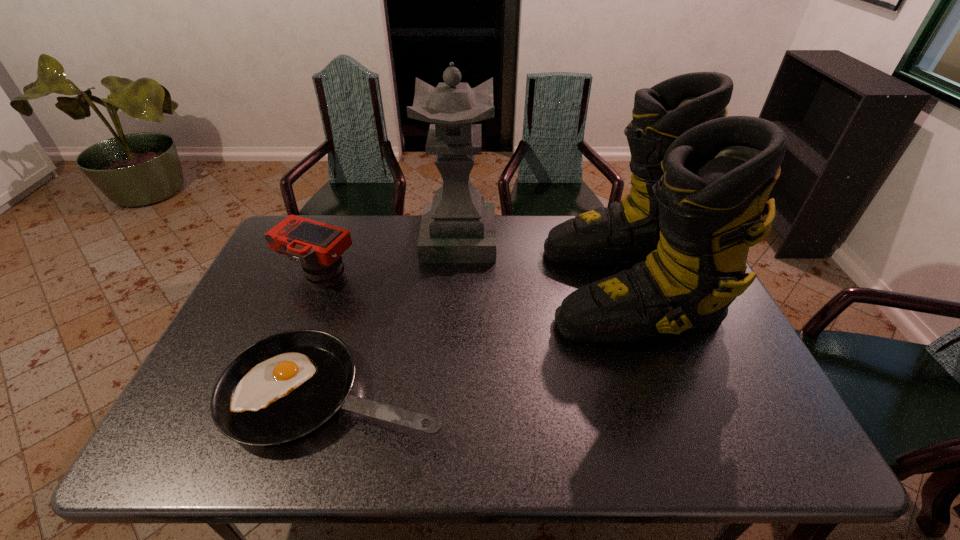
At what (x,y) coordinates should I click in order to perform the action: click on sculpture. Please return your answer as a coordinate pair (x, y). Looking at the image, I should click on (457, 227).

Locate an element on the screen. the rightmost object is located at coordinates (700, 180).

Find the location of a particular element. The height and width of the screenshot is (540, 960). camera is located at coordinates (318, 247).

Where is `the shortest object`? The image size is (960, 540). the shortest object is located at coordinates (283, 387).

Where is `vacant space located 0.220m at the front opening of the sculpture`? This screenshot has height=540, width=960. vacant space located 0.220m at the front opening of the sculpture is located at coordinates (561, 240).

I want to click on free space located on the back of the rightmost object, so click(604, 222).

The image size is (960, 540). Find the location of `vacant space located on the back of the camera`. vacant space located on the back of the camera is located at coordinates (341, 221).

The image size is (960, 540). Identify the location of vacant position located on the right of the shortest object. (518, 393).

Image resolution: width=960 pixels, height=540 pixels. Identify the location of sculpture that is at the far edge. (457, 227).

At what (x,y) coordinates should I click in order to perform the action: click on ski boots located at the far edge. Please return your answer as a coordinate pair (x, y). This screenshot has width=960, height=540. Looking at the image, I should click on (700, 180).